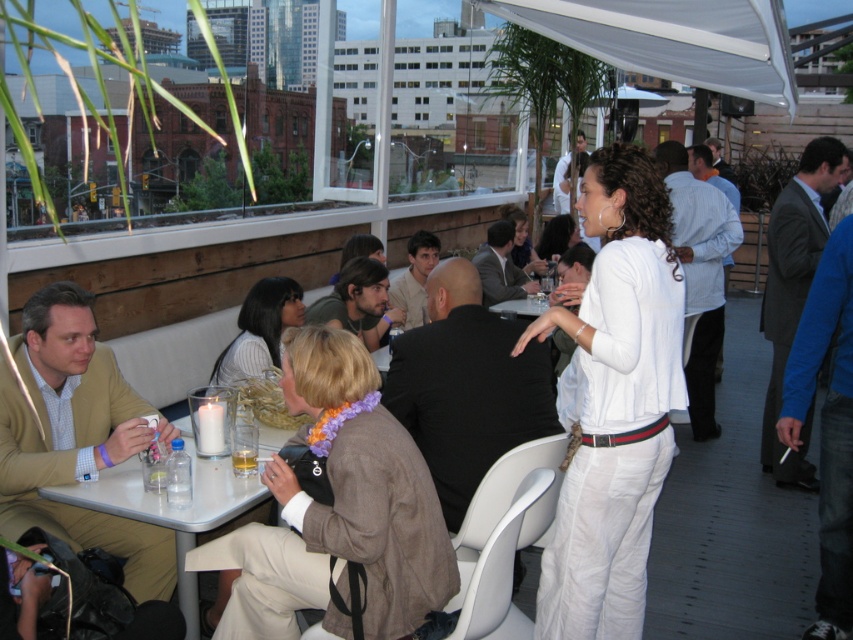
You are planning to place a decorative centerpiece on the white plastic table at lower left. Considering the size of the translucent glass at table left, will the centerpiece fit on the table?

The white plastic table at lower left is larger in size than the translucent glass at table left, so the centerpiece should fit as the table is bigger than the glass.

You are a photographer standing at the edge of the rooftop, and you want to take a photo of the matte brown blazer at center and the dark brown hair at center. Can you fit both subjects into a single frame if your camera has a maximum field of view of 5 feet?

The distance between the matte brown blazer at center and the dark brown hair at center is 5.76 feet, which exceeds the camera field of view of 5 feet. Therefore, you cannot fit both subjects into a single frame.

You are a photographer standing at the center of the rooftop. You want to take a photo of the matte brown blazer at center. According to the coordinates provided, where should you aim your camera?

The matte brown blazer at center is located at coordinates point (338, 512), so you should aim your camera at that point to capture it.